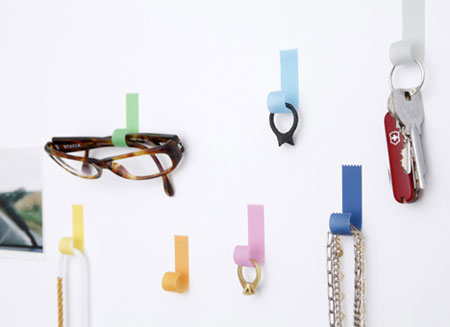
I want to click on yellow hook, so click(x=80, y=239).